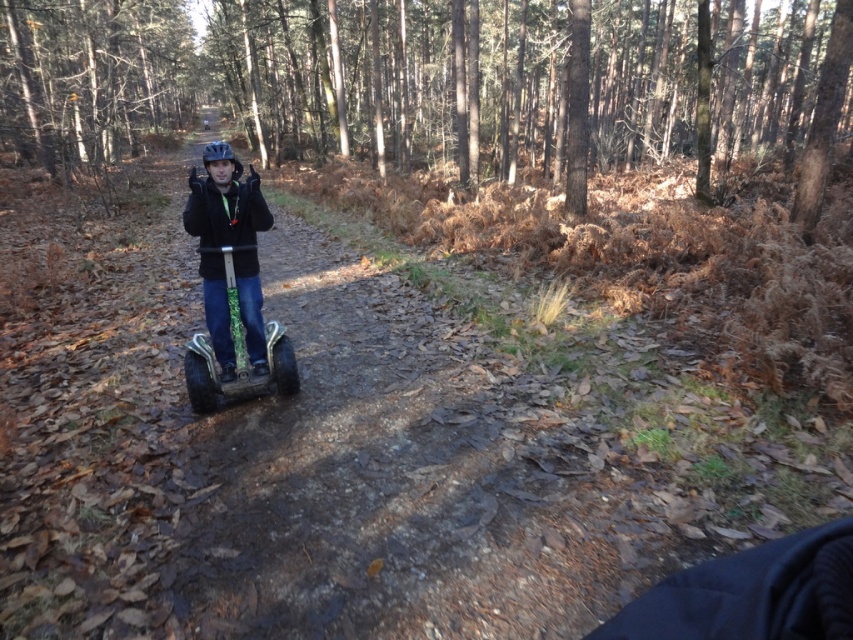
You are a photographer trying to capture the entire scene of the brown matte forest at center and the green textured segway at center in one shot. Based on their widths, which object will require you to adjust your camera angle more to ensure it fits entirely within the frame?

The brown matte forest at center requires adjusting the camera angle more because its width surpasses that of the green textured segway at center, meaning it occupies more space in the frame.

You are navigating a Segway along the forest trail and need to pass between two points marked as point (387,19) and point (236,381). Which point is closer to you as you ride towards them?

Point (387,19) is further to the viewer than point (236,381), so the closer point is point (236,381).

You are a photographer standing behind the camera and want to capture a clear photo of the matte black helmet at center. The camera is set to a focus range of 2 meters. Can you take the photo without moving the camera?

The distance between the matte black helmet at center and the camera is 3.09 meters, which exceeds the camera focus range of 2 meters. Therefore, you cannot take a clear photo without moving the camera closer.